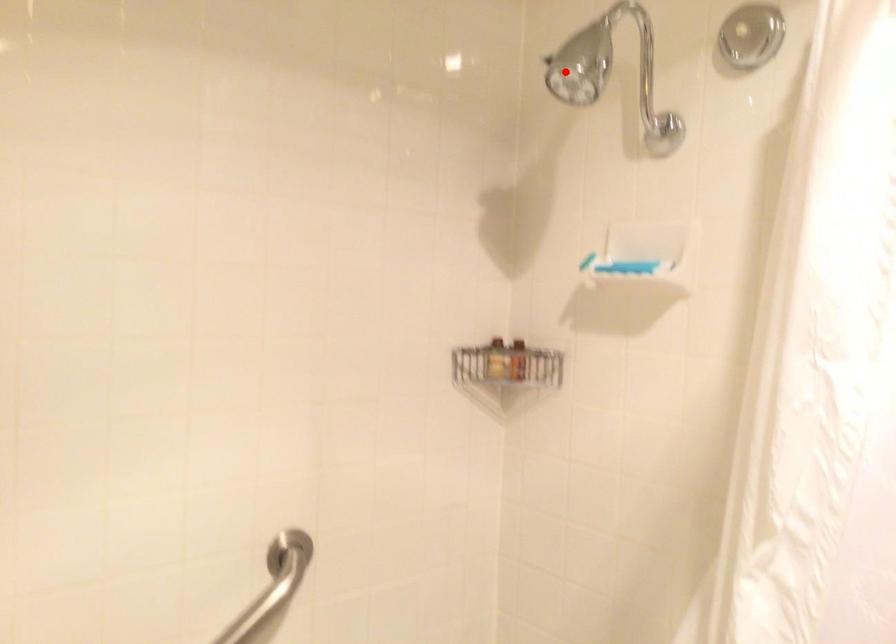
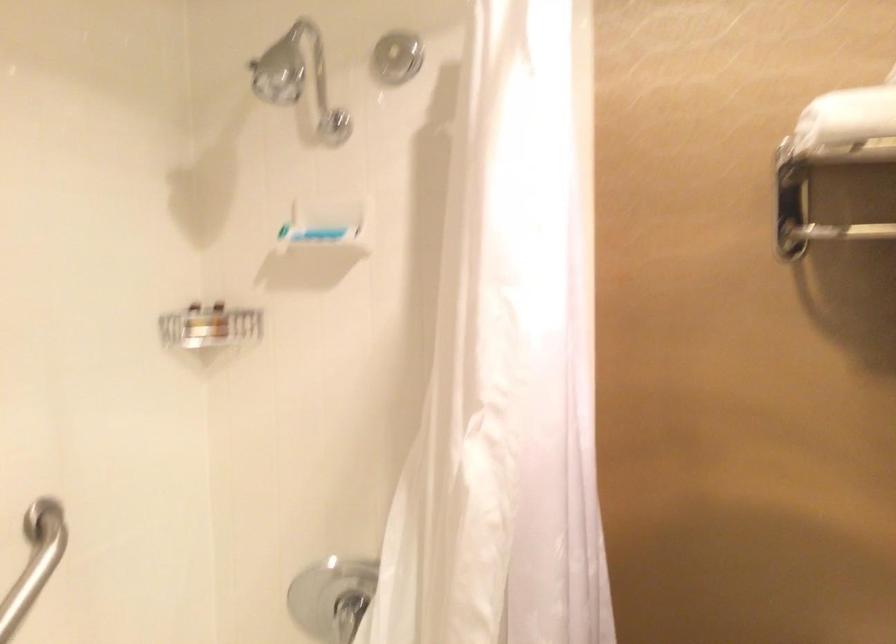
Locate, in the second image, the point that corresponds to the highlighted location in the first image.

(279, 73)